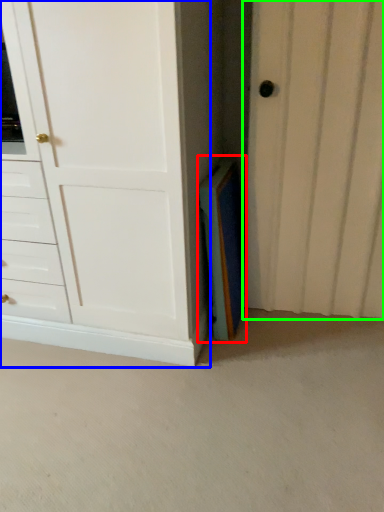
Question: Which is nearer to the paperback book (highlighted by a red box)? chest of drawers (highlighted by a blue box) or door (highlighted by a green box).

Choices:
 (A) chest of drawers
 (B) door

Answer: (B)